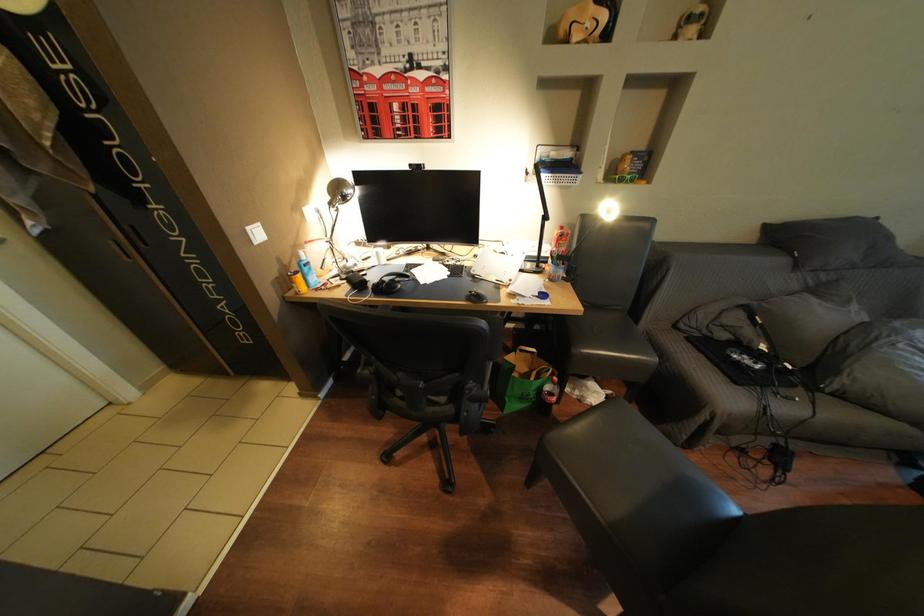
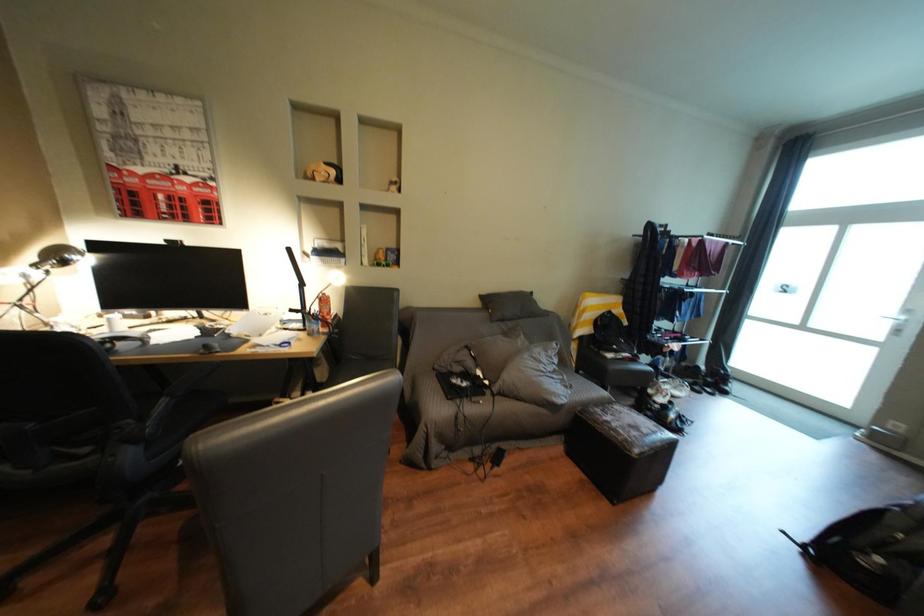
From the picture: The first image is from the beginning of the video and the second image is from the end. How did the camera likely rotate when shooting the video?

The camera's rotation is toward right-up.